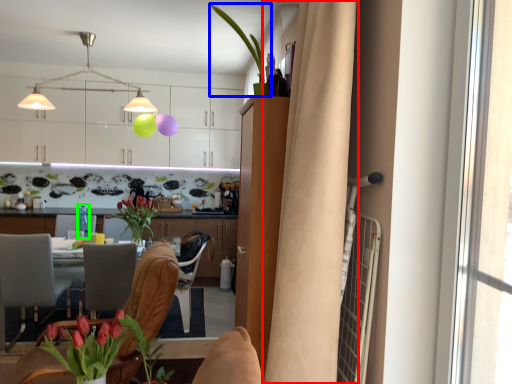
Question: Considering the real-world distances, which object is closest to curtain (highlighted by a red box)? houseplant (highlighted by a blue box) or bottle (highlighted by a green box).

Choices:
 (A) houseplant
 (B) bottle

Answer: (A)